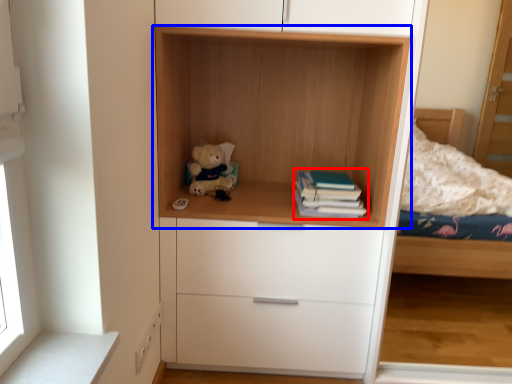
Question: Which of the following is the farthest to the observer, paperback book (highlighted by a red box) or shelf (highlighted by a blue box)?

Choices:
 (A) paperback book
 (B) shelf

Answer: (A)